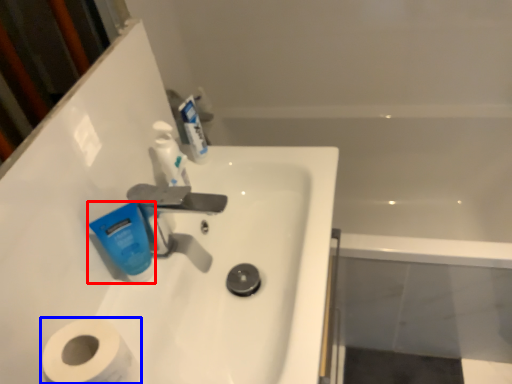
Question: Which object appears closest to the camera in this image, mouthwash (highlighted by a red box) or toilet paper (highlighted by a blue box)?

Choices:
 (A) mouthwash
 (B) toilet paper

Answer: (B)